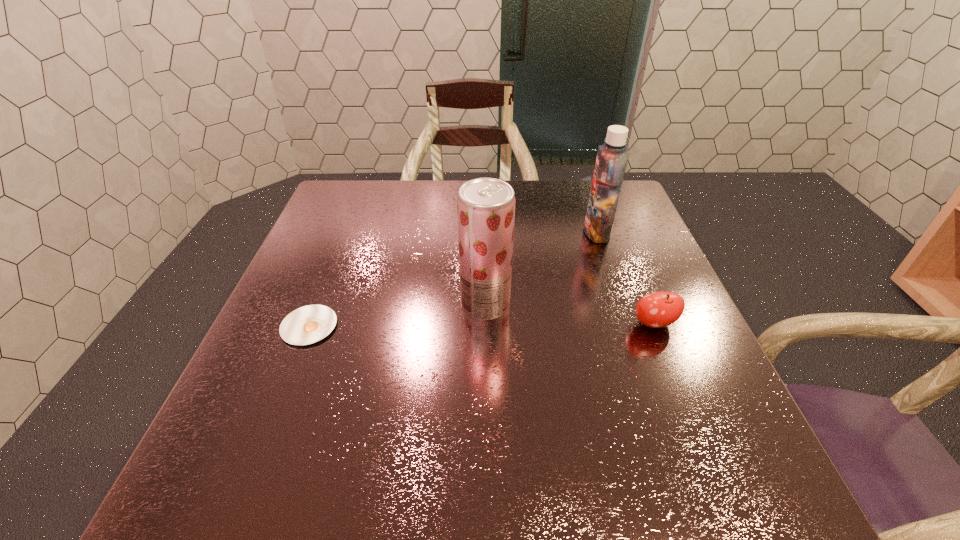
Where is `free space in the image that satisfies the following two spatial constraints: 1. on the front side of the fruit juice; 2. on the left side of the apple`? free space in the image that satisfies the following two spatial constraints: 1. on the front side of the fruit juice; 2. on the left side of the apple is located at coordinates (486, 324).

The image size is (960, 540). Find the location of `free space that satisfies the following two spatial constraints: 1. on the front label of the shampoo; 2. on the front side of the leftmost object`. free space that satisfies the following two spatial constraints: 1. on the front label of the shampoo; 2. on the front side of the leftmost object is located at coordinates (629, 326).

The height and width of the screenshot is (540, 960). Find the location of `free spot that satisfies the following two spatial constraints: 1. on the back side of the apple; 2. on the left side of the egg yolk`. free spot that satisfies the following two spatial constraints: 1. on the back side of the apple; 2. on the left side of the egg yolk is located at coordinates (310, 324).